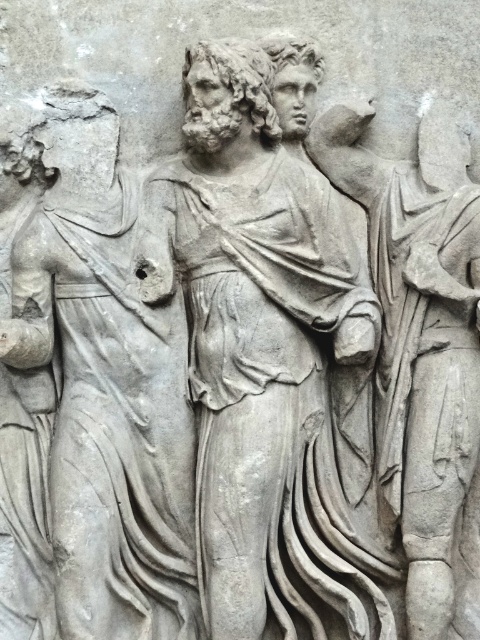
Is gray stone statue at center further to camera compared to gray stone figure at left?

That is True.

The width and height of the screenshot is (480, 640). What do you see at coordinates (261, 348) in the screenshot? I see `gray stone statue at center` at bounding box center [261, 348].

Does point (304, 406) come closer to viewer compared to point (40, 200)?

Yes, it is.

The height and width of the screenshot is (640, 480). Find the location of `gray stone statue at center`. gray stone statue at center is located at coordinates (x=261, y=348).